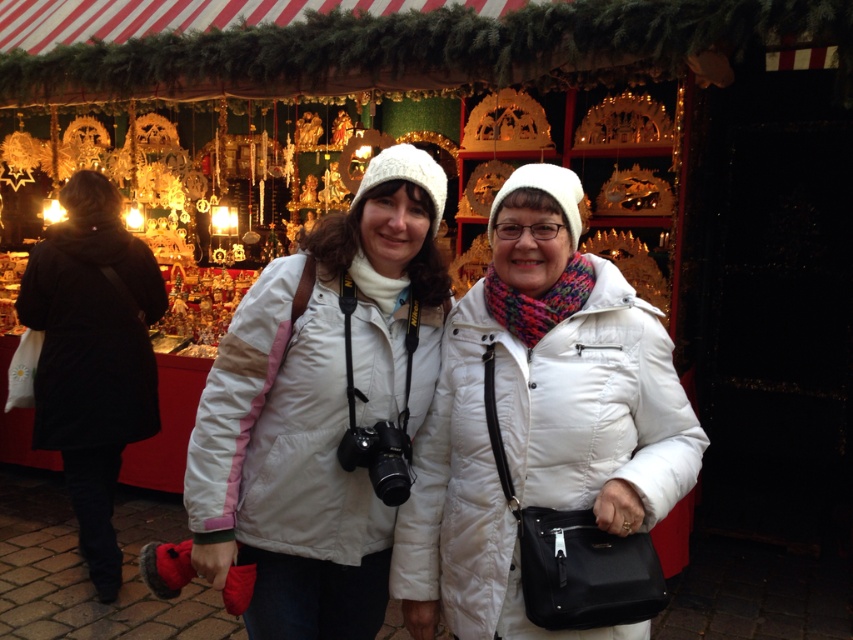
You are a photographer trying to capture both the white puffy jacket at center and the black matte coat at left in a single frame. Which of the two clothing items is shorter in height?

The white puffy jacket at center is shorter in height compared to the black matte coat at left.

Looking at this image, you are standing in front of the festive market stall and want to find the white matte jacket at center. According to the coordinates provided, where should you look to locate it?

The white matte jacket at center is located at the 2D coordinates point (318, 410).

You are standing in front of the festive market stall and see the white matte jacket at center and the black matte coat at left. Which one is positioned to the right of the other?

The white matte jacket at center is positioned to the right of the black matte coat at left.